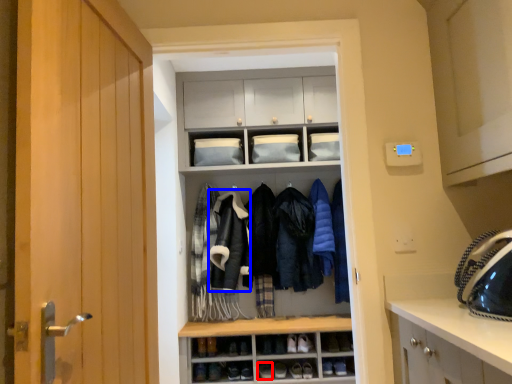
Question: Which of the following is the closest to the observer, shoe (highlighted by a red box) or sweatshirt (highlighted by a blue box)?

Choices:
 (A) shoe
 (B) sweatshirt

Answer: (A)